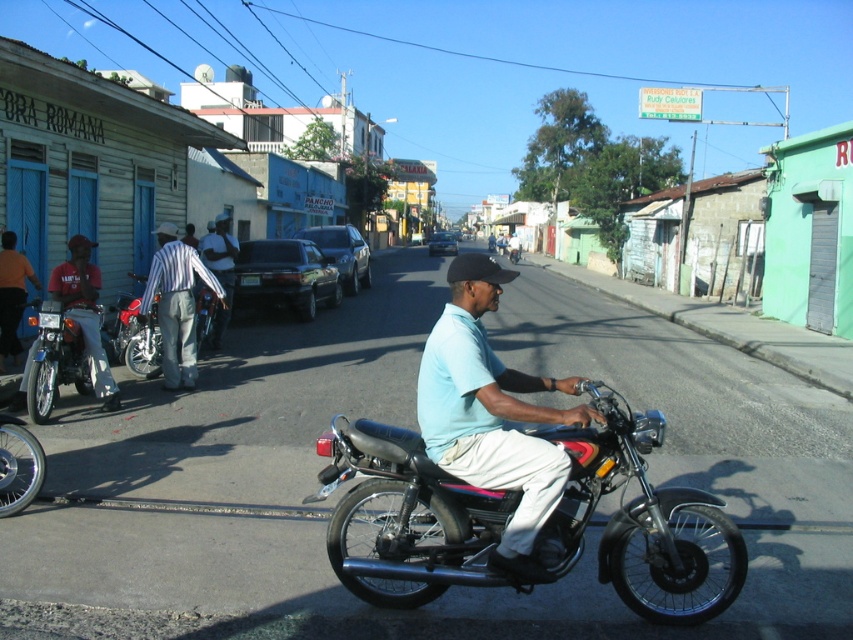
You are a pedestrian standing on the sidewalk and see the shiny black motorcycle at center and the striped fabric pants at left. Which object is closer to you?

The shiny black motorcycle at center is closer to you because it is positioned under the striped fabric pants at left, meaning the motorcycle is in front of the pants from your perspective.

In the scene shown: You are a pedestrian standing on the sidewalk and see both the shiny black motorcycle at center and the light blue fabric shirt at center. Which object is closer to the right side of the image?

The shiny black motorcycle at center is closer to the right side of the image because it is positioned to the right of the light blue fabric shirt at center.

You are a delivery person who needs to park your motorcycle in a specific spot marked by the coordinates point (640, 518). Based on the scene, where should you position your motorcycle?

The shiny black motorcycle at center is located at point (640, 518), so you should position your motorcycle at the center of the scene to park it at the specified coordinates.